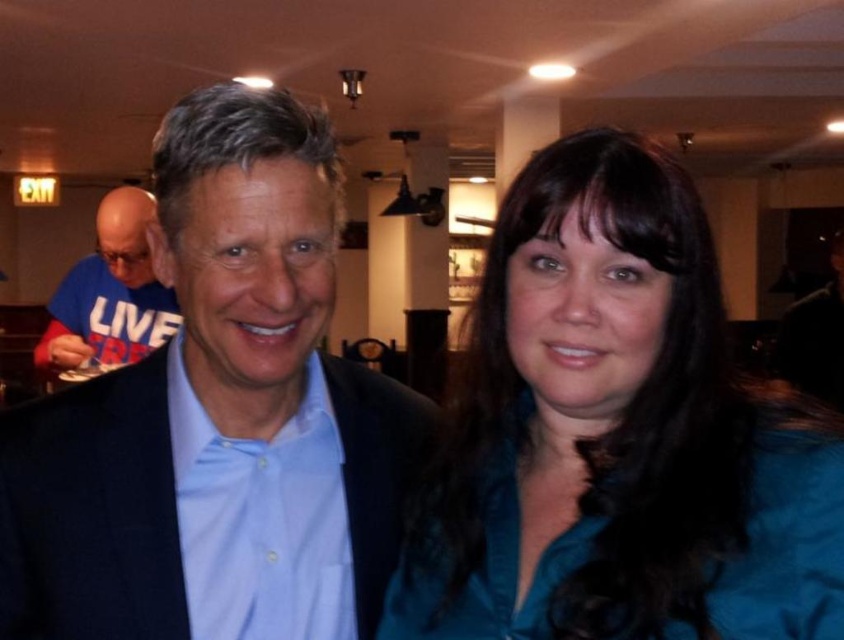
Question: Is teal satin blouse at center positioned behind matte blue shirt at center?

Choices:
 (A) no
 (B) yes

Answer: (A)

Question: Is teal satin blouse at center closer to camera compared to matte blue shirt at center?

Choices:
 (A) no
 (B) yes

Answer: (B)

Question: Can you confirm if matte blue shirt at center is positioned to the right of blue t-shirt at left?

Choices:
 (A) yes
 (B) no

Answer: (A)

Question: Considering the real-world distances, which object is closest to the teal satin blouse at center?

Choices:
 (A) matte blue shirt at center
 (B) blue t-shirt at left

Answer: (A)

Question: Among these points, which one is farthest from the camera?

Choices:
 (A) pyautogui.click(x=431, y=625)
 (B) pyautogui.click(x=255, y=522)

Answer: (B)

Question: Which object is positioned farthest from the teal satin blouse at center?

Choices:
 (A) matte blue shirt at center
 (B) blue t-shirt at left

Answer: (B)